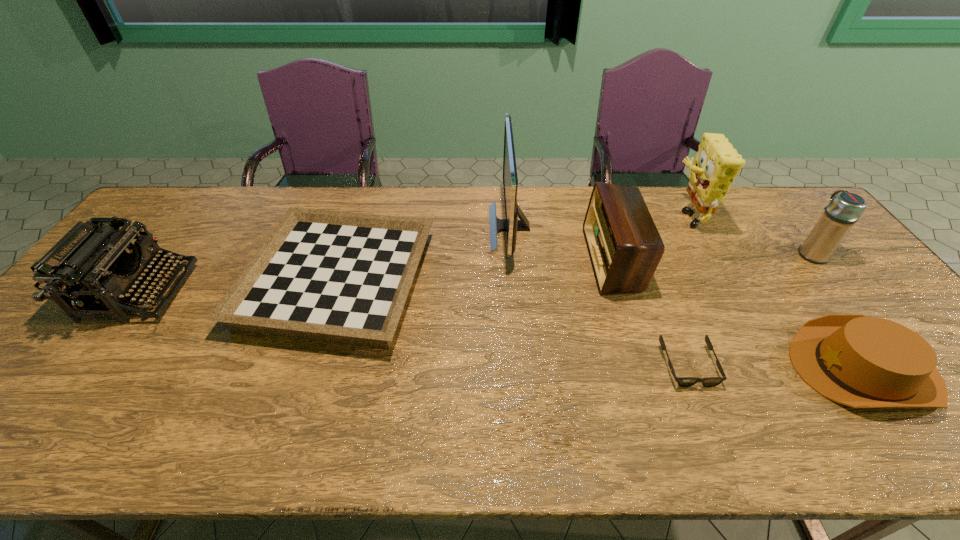
Locate an element on the screen. This screenshot has width=960, height=540. vacant space located 0.340m on the front-facing side of the radio receiver is located at coordinates (475, 259).

Find the location of a particular element. The width and height of the screenshot is (960, 540). vacant area situated on the front of the seventh tallest object is located at coordinates (303, 390).

At what (x,y) coordinates should I click in order to perform the action: click on vacant position located on the temples of the shortest object. Please return your answer as a coordinate pair (x, y). Looking at the image, I should click on (707, 413).

This screenshot has height=540, width=960. What are the coordinates of `monitor that is positioned at the far edge` in the screenshot? It's located at (511, 224).

I want to click on sponge at the far edge, so pos(717,163).

Where is `radio receiver that is positioned at the far edge`? radio receiver that is positioned at the far edge is located at coordinates (624, 245).

Where is `checkerboard positioned at the far edge`? This screenshot has height=540, width=960. checkerboard positioned at the far edge is located at coordinates (343, 277).

Image resolution: width=960 pixels, height=540 pixels. I want to click on object at the left edge, so click(88, 269).

Identify the location of object that is at the right edge. The height and width of the screenshot is (540, 960). [x=844, y=210].

Locate an element on the screen. This screenshot has width=960, height=540. free location at the far edge of the desktop is located at coordinates point(485,207).